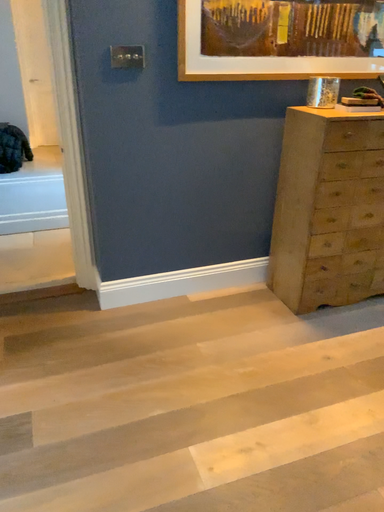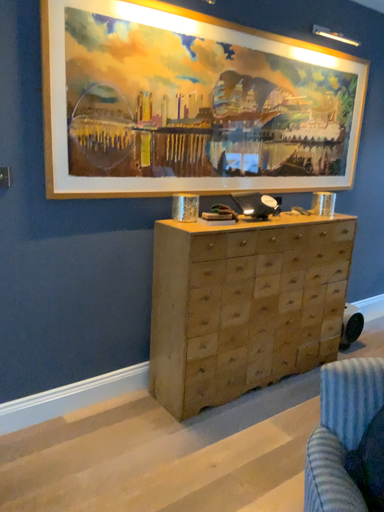
Question: Which way did the camera rotate in the video?

Choices:
 (A) rotated left
 (B) rotated right

Answer: (B)